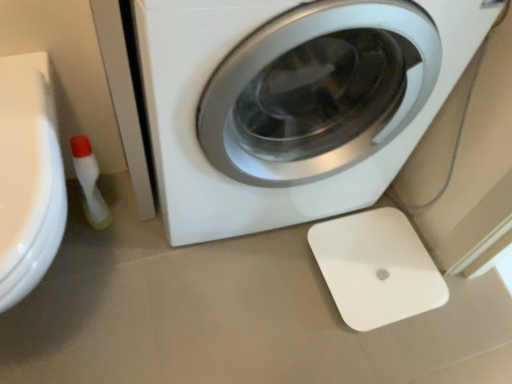
Where is `free space to the left of white plastic scale at lower right`? This screenshot has width=512, height=384. free space to the left of white plastic scale at lower right is located at coordinates (271, 279).